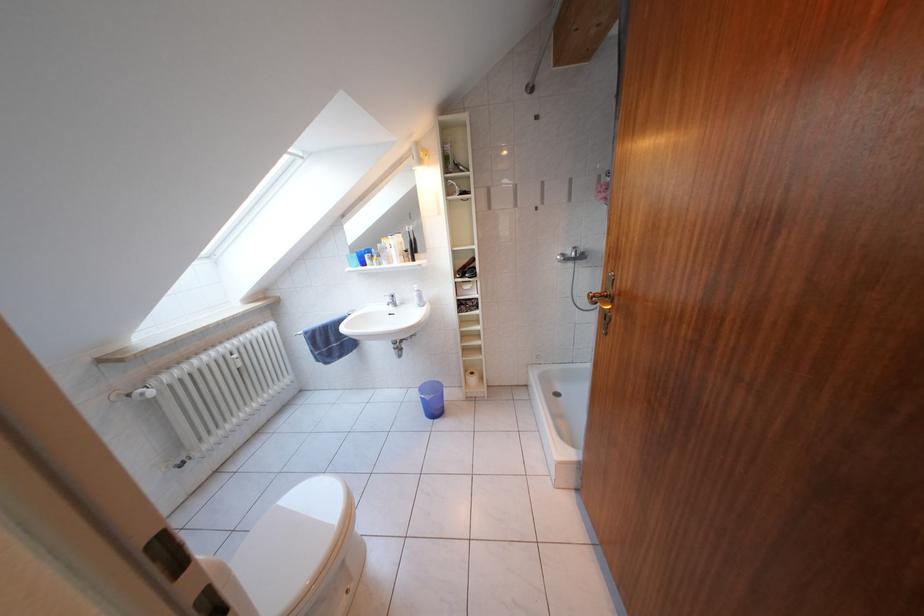
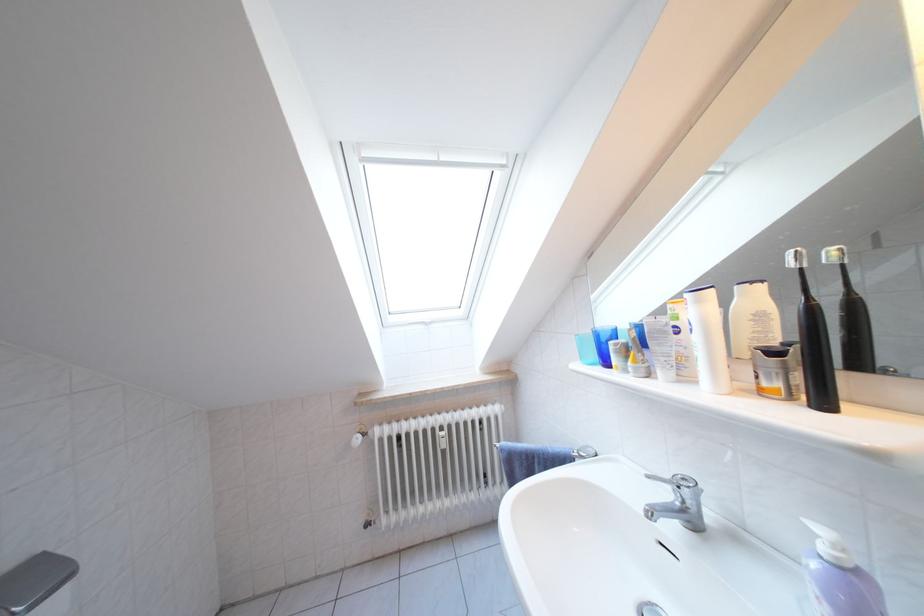
In the second image, find the point that corresponds to the point at 421,265 in the first image.

(833, 407)